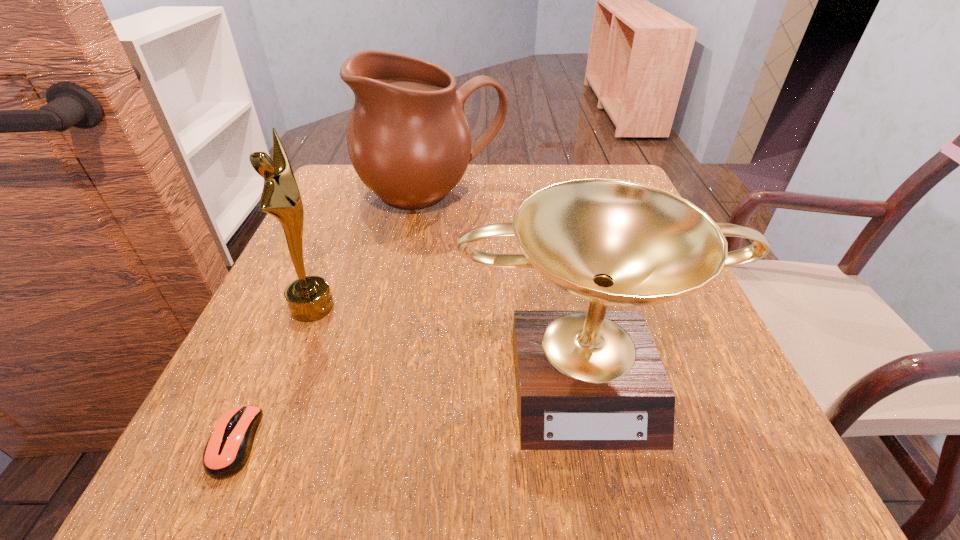
Choose which object is the second nearest neighbor to the left award. Please provide its 2D coordinates. Your answer should be formatted as a tuple, i.e. [(x, y)], where the tuple contains the x and y coordinates of a point satisfying the conditions above.

[(408, 139)]

Where is `the closest object to the right award`? The image size is (960, 540). the closest object to the right award is located at coordinates (309, 298).